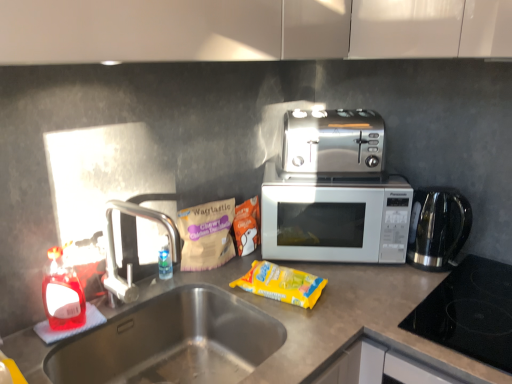
Question: From the image's perspective, is yellow plastic packet at center, arranged as the 3th snack when viewed from the left, positioned above or below silver metallic microwave at center?

Choices:
 (A) above
 (B) below

Answer: (B)

Question: Does point (298, 294) appear closer or farther from the camera than point (297, 231)?

Choices:
 (A) farther
 (B) closer

Answer: (B)

Question: Which of these objects is positioned closest to the silver metallic microwave at center?

Choices:
 (A) black glass cooktop at lower right
 (B) silver metallic faucet at left
 (C) yellow plastic packet at center, the first snack in the right-to-left sequence
 (D) translucent plastic bottle at sink left
 (E) stainless steel kettle at right

Answer: (E)

Question: Based on their relative distances, which object is nearer to the black glass cooktop at lower right?

Choices:
 (A) stainless steel sink at lower left
 (B) translucent plastic bottle at sink left
 (C) yellow plastic packet at center, arranged as the 3th snack when viewed from the left
 (D) matte brown packet of waglastic chewy chicken treats at sink left, which is the 1th snack from left to right
 (E) matte brown packet of snacks at center, which appears as the second snack when viewed from the right

Answer: (C)